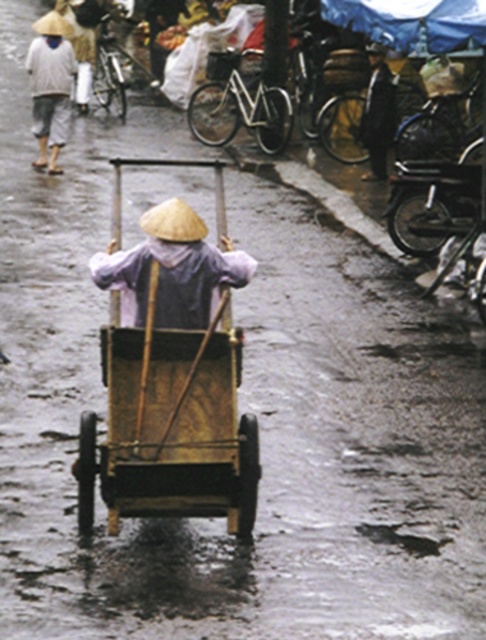
Question: Among these points, which one is nearest to the camera?

Choices:
 (A) (174, 308)
 (B) (34, 70)

Answer: (A)

Question: Does wooden cart at center appear over white cotton shirt at upper left?

Choices:
 (A) no
 (B) yes

Answer: (A)

Question: Which point appears closest to the camera in this image?

Choices:
 (A) (129, 264)
 (B) (173, 340)

Answer: (B)

Question: Which point appears farthest from the camera in this image?

Choices:
 (A) (181, 316)
 (B) (123, 160)
 (C) (58, 42)

Answer: (B)

Question: Where is matte straw hat at center located in relation to white cotton shirt at upper left in the image?

Choices:
 (A) right
 (B) left

Answer: (A)

Question: Considering the relative positions of wooden cart at center and matte straw hat at center in the image provided, where is wooden cart at center located with respect to matte straw hat at center?

Choices:
 (A) right
 (B) left

Answer: (A)